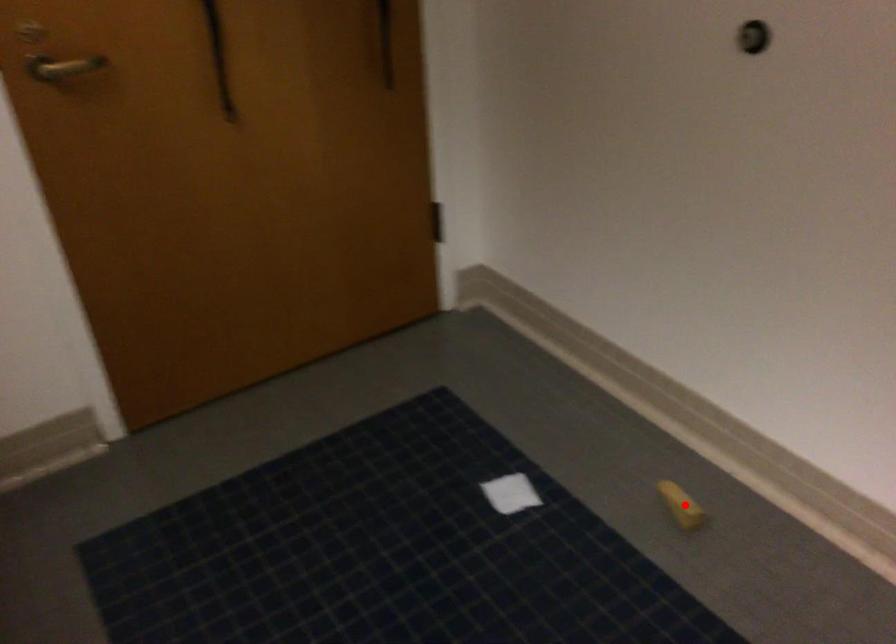
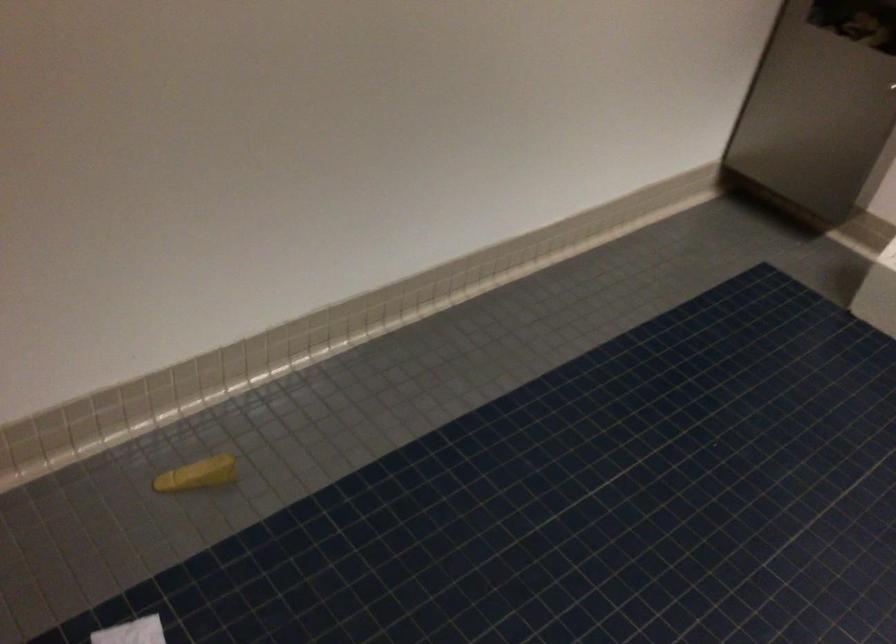
In the second image, find the point that corresponds to the highlighted location in the first image.

(197, 474)